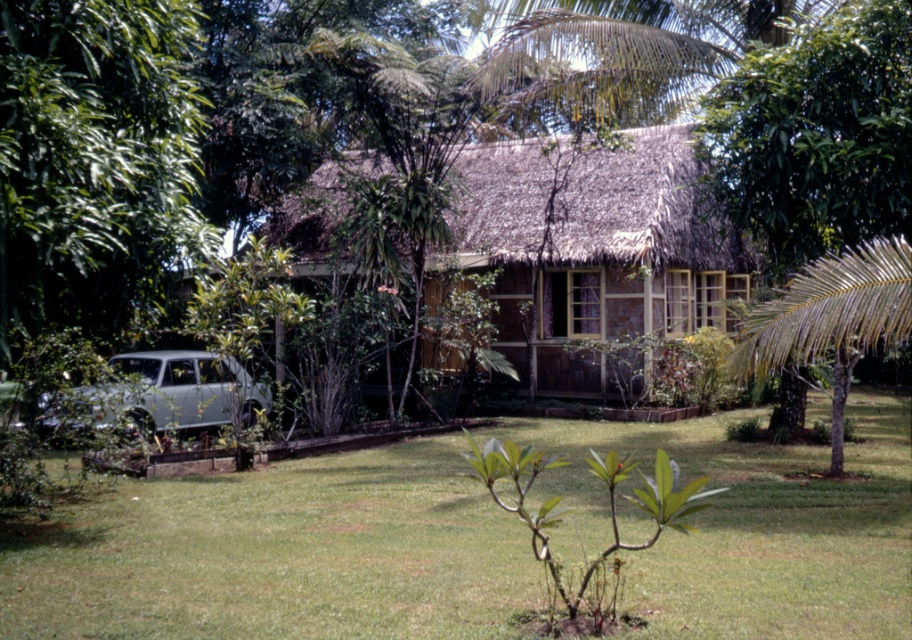
Is green grass at lower center above green leafy tree at left?

Incorrect, green grass at lower center is not positioned above green leafy tree at left.

Who is more distant from viewer, [848,592] or [27,324]?

The point [27,324] is behind.

Locate an element on the screen. green grass at lower center is located at coordinates click(278, 554).

You are a GUI agent. You are given a task and a screenshot of the screen. Output one action in this format:
    pyautogui.click(x=<x>, y=<y>)
    Task: Click on the green grass at lower center
    The image size is (912, 640).
    Given the screenshot: What is the action you would take?
    pyautogui.click(x=278, y=554)

How distant is green leafy tree at left from white matte car at lower left?

They are 9.03 meters apart.

Can you confirm if green leafy tree at left is thinner than white matte car at lower left?

Incorrect, green leafy tree at left's width is not less than white matte car at lower left's.

Measure the distance between green leafy tree at left and camera.

6.74 meters

The image size is (912, 640). I want to click on green leafy tree at left, so click(95, 161).

Measure the distance from green grass at lower center to wooden cottage at center.

The distance of green grass at lower center from wooden cottage at center is 6.45 meters.

Is green grass at lower center below wooden cottage at center?

Yes.

The width and height of the screenshot is (912, 640). What do you see at coordinates (278, 554) in the screenshot?
I see `green grass at lower center` at bounding box center [278, 554].

I want to click on green grass at lower center, so click(278, 554).